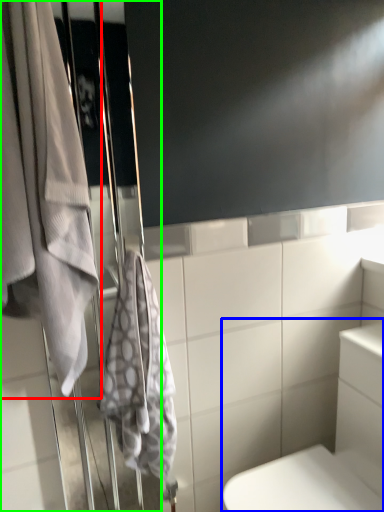
Question: Which object is the closest to the towel (highlighted by a red box)? Choose among these: bath (highlighted by a blue box) or screen door (highlighted by a green box).

Choices:
 (A) bath
 (B) screen door

Answer: (B)